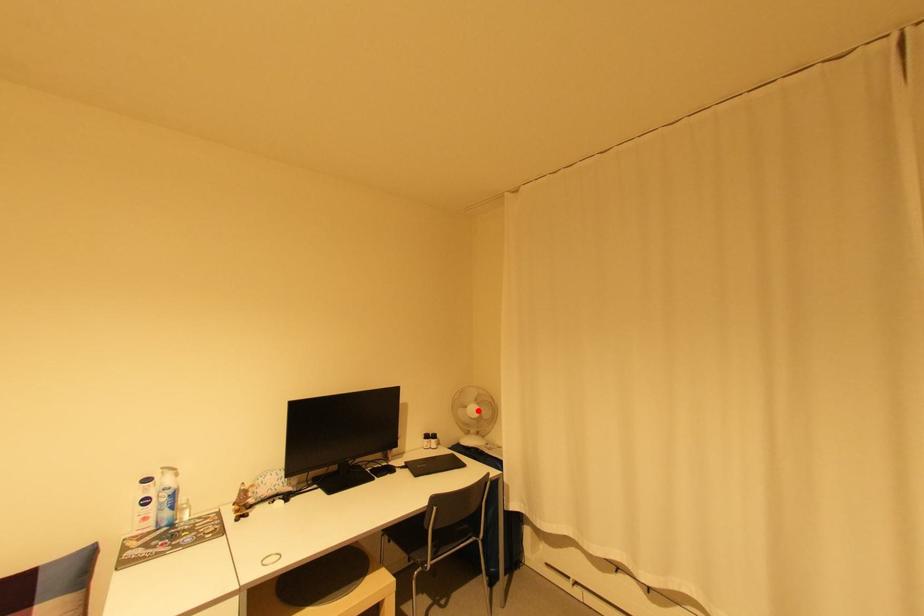
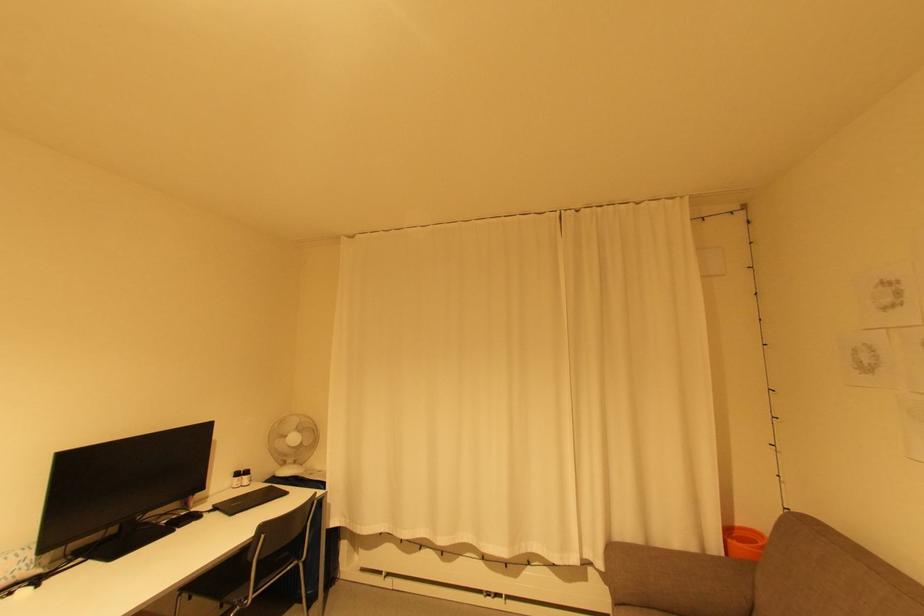
Locate, in the second image, the point that corresponds to the highlighted location in the first image.

(298, 439)